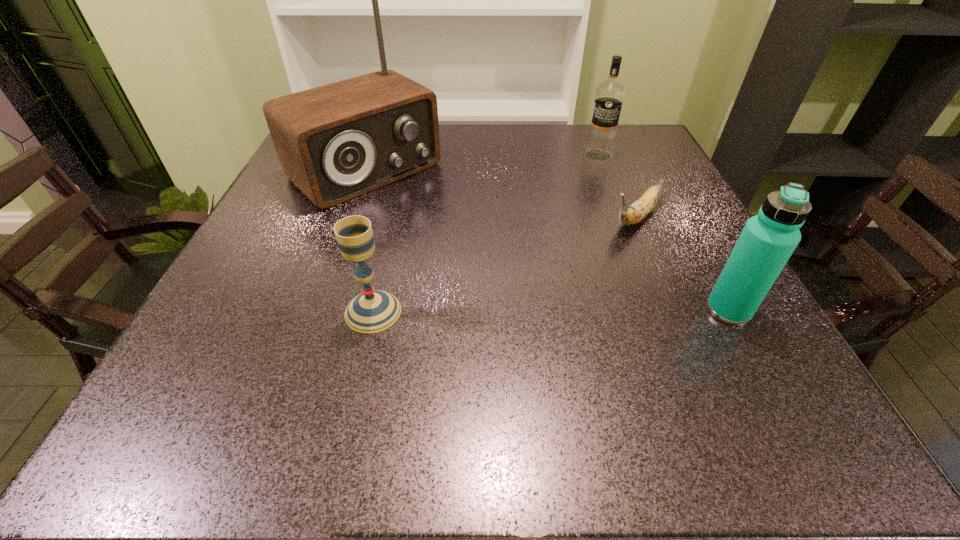
In the image, there is a desktop. Where is `free region at the far right corner`? This screenshot has height=540, width=960. free region at the far right corner is located at coordinates (607, 168).

The image size is (960, 540). Identify the location of vacant area that lies between the water bottle and the fourth tallest object. (551, 310).

Locate an element on the screen. vacant point located between the vodka and the radio receiver is located at coordinates (482, 163).

The height and width of the screenshot is (540, 960). Identify the location of vacant point located between the water bottle and the vodka. (663, 233).

At what (x,y) coordinates should I click in order to perform the action: click on vacant point located between the water bottle and the radio receiver. Please return your answer as a coordinate pair (x, y). The width and height of the screenshot is (960, 540). Looking at the image, I should click on (547, 240).

You are a GUI agent. You are given a task and a screenshot of the screen. Output one action in this format:
    pyautogui.click(x=<x>, y=<y>)
    Task: Click on the free area in between the chalice and the vodka
    
    Given the screenshot: What is the action you would take?
    pyautogui.click(x=486, y=233)

Where is `unoccupied area between the shortest object and the second shortest object`? unoccupied area between the shortest object and the second shortest object is located at coordinates (504, 264).

I want to click on vacant area between the vodka and the water bottle, so click(663, 233).

You are a GUI agent. You are given a task and a screenshot of the screen. Output one action in this format:
    pyautogui.click(x=<x>, y=<y>)
    Task: Click on the free spot between the tallest object and the water bottle
    This screenshot has height=540, width=960.
    Given the screenshot: What is the action you would take?
    pyautogui.click(x=547, y=240)

Where is `free space between the vodka and the water bottle`? free space between the vodka and the water bottle is located at coordinates (663, 233).